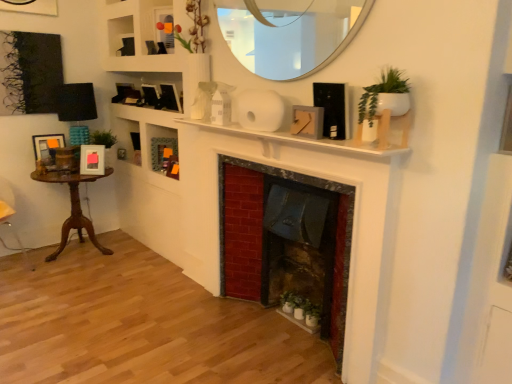
Question: Choose the correct answer: Is green matte cabinet at center inside white glossy mirror at upper center or outside it?

Choices:
 (A) inside
 (B) outside

Answer: (B)

Question: In terms of height, does green matte cabinet at center look taller or shorter compared to white glossy mirror at upper center?

Choices:
 (A) tall
 (B) short

Answer: (B)

Question: Which object is positioned farthest from the white matte fireplace at center?

Choices:
 (A) matte black picture frame at upper center, which is the second picture frame from right to left
 (B) green matte plant at lower center
 (C) wooden table at left
 (D) matte gray picture frame at center, positioned as the first picture frame in front-to-back order
 (E) red brick fireplace at center

Answer: (C)

Question: Based on their relative distances, which object is nearer to the wooden table at left?

Choices:
 (A) white matte fireplace at center
 (B) matte white picture frame at left, arranged as the fourth picture frame when viewed from the right
 (C) red brick fireplace at center
 (D) green matte cabinet at center
 (E) white glossy mirror at upper center

Answer: (B)